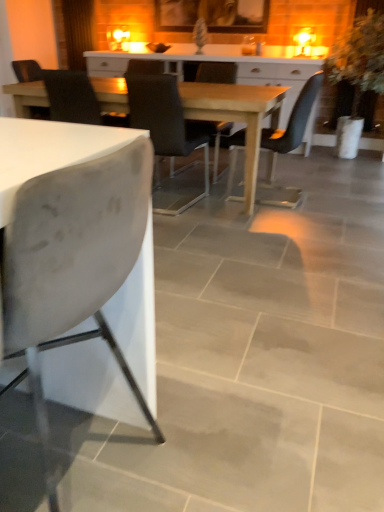
Question: Considering their positions, is matte black chair at center, which is the 3th chair from back to front, located in front of or behind matte black chair at center, which ranks as the fifth chair in front-to-back order?

Choices:
 (A) front
 (B) behind

Answer: (A)

Question: Is matte black chair at center, the third chair in the front-to-back sequence, inside the boundaries of matte black chair at center, marked as the 1th chair in a back-to-front arrangement, or outside?

Choices:
 (A) outside
 (B) inside

Answer: (A)

Question: Based on their relative distances, which object is nearer to the velvet black chair at center, placed as the 4th chair when sorted from front to back?

Choices:
 (A) white matte chair at left, which ranks as the 5th chair in back-to-front order
 (B) matte black chair at center, which is the 3th chair from back to front
 (C) matte black chair at center, which ranks as the fifth chair in front-to-back order
 (D) matte black chair at center, arranged as the 4th chair when viewed from the back
 (E) green leafy plant at right

Answer: (D)

Question: Which is farther from the velvet black chair at center, which is counted as the 2th chair, starting from the back?

Choices:
 (A) matte black chair at center, which is counted as the second chair, starting from the front
 (B) green leafy plant at right
 (C) matte black chair at center, marked as the 1th chair in a back-to-front arrangement
 (D) wooden table at center
 (E) white matte chair at left, which ranks as the 5th chair in back-to-front order

Answer: (B)